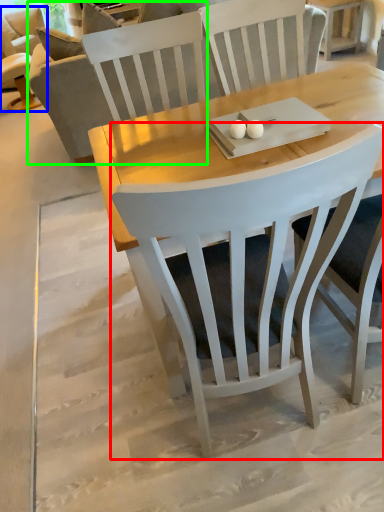
Question: Which is nearer to the chair (highlighted by a red box)? chair (highlighted by a blue box) or couch (highlighted by a green box).

Choices:
 (A) chair
 (B) couch

Answer: (B)